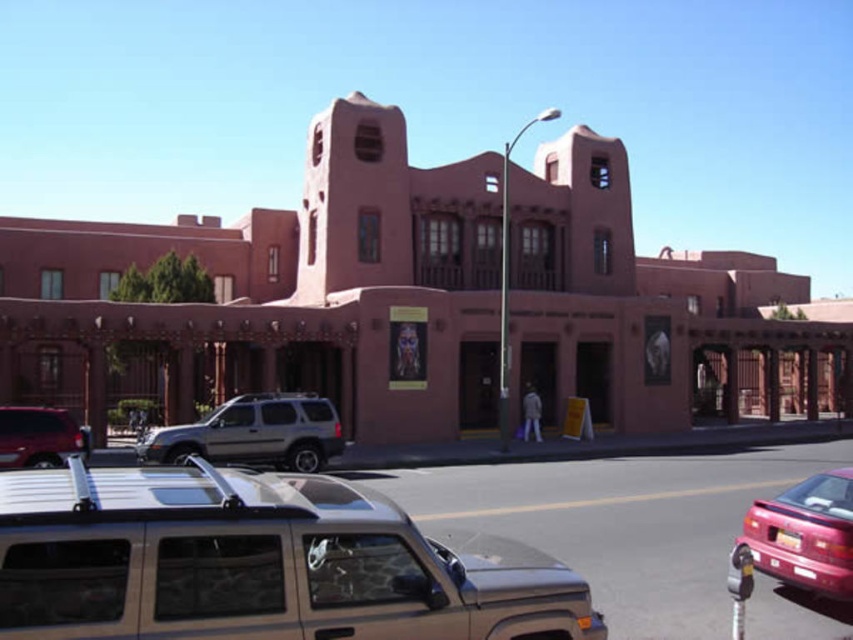
Does silver metallic minivan at center have a smaller size compared to matte silver suv at lower left?

Actually, silver metallic minivan at center might be larger than matte silver suv at lower left.

Does silver metallic minivan at center lie behind matte silver suv at lower left?

No, silver metallic minivan at center is in front of matte silver suv at lower left.

The height and width of the screenshot is (640, 853). Find the location of `silver metallic minivan at center`. silver metallic minivan at center is located at coordinates (257, 563).

At what (x,y) coordinates should I click in order to perform the action: click on silver metallic minivan at center. Please return your answer as a coordinate pair (x, y). Looking at the image, I should click on (257, 563).

Which is behind, point (163, 435) or point (840, 484)?

Positioned behind is point (163, 435).

This screenshot has width=853, height=640. What do you see at coordinates (253, 433) in the screenshot? I see `silver metallic suv at center` at bounding box center [253, 433].

Locate an element on the screen. silver metallic suv at center is located at coordinates (253, 433).

Which is above, silver metallic suv at center or matte silver suv at lower left?

matte silver suv at lower left is higher up.

Which is below, silver metallic suv at center or matte silver suv at lower left?

silver metallic suv at center is below.

Is point (206, 435) closer to camera compared to point (57, 456)?

No, it is not.

I want to click on silver metallic suv at center, so click(253, 433).